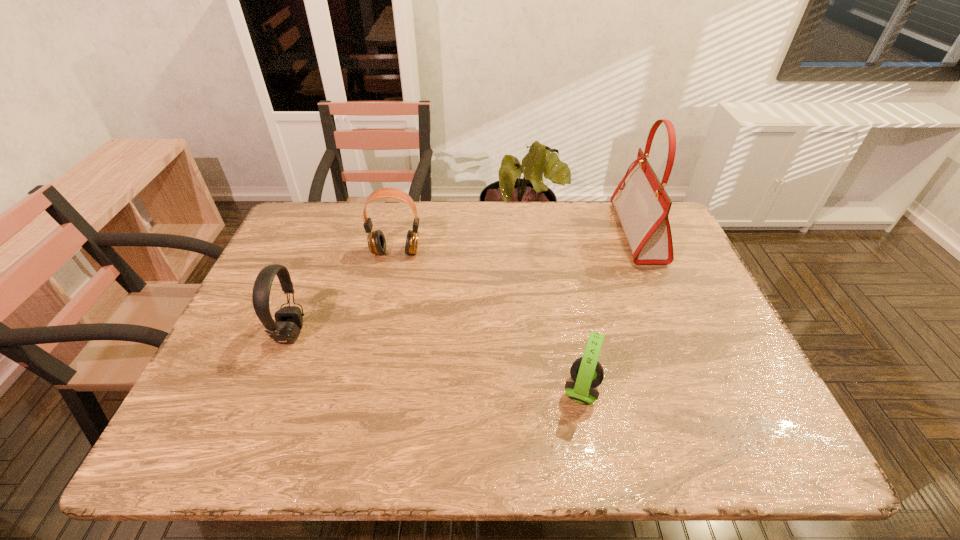
Identify the location of free spot that satisfies the following two spatial constraints: 1. on the ear cups of the second object from left to right; 2. on the front-facing side of the leftmost headset. (378, 333).

In order to click on vacant space that satisfies the following two spatial constraints: 1. on the ear cups of the farthest headset; 2. on the front-facing side of the leftmost object in this screenshot , I will do `click(378, 333)`.

Find the location of `vacant point that satisfies the following two spatial constraints: 1. on the back side of the tallest object; 2. on the left side of the rightmost headset`. vacant point that satisfies the following two spatial constraints: 1. on the back side of the tallest object; 2. on the left side of the rightmost headset is located at coordinates (551, 232).